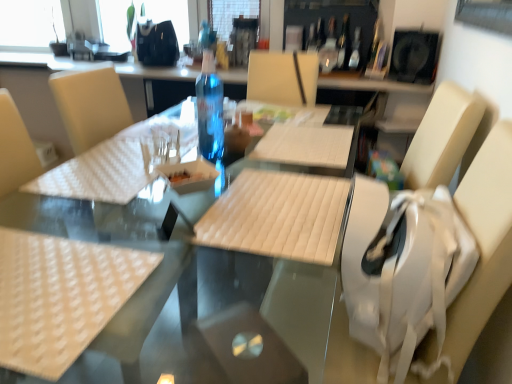
I want to click on free spot above beige quilted placemat at lower left (from a real-world perspective), so [49, 280].